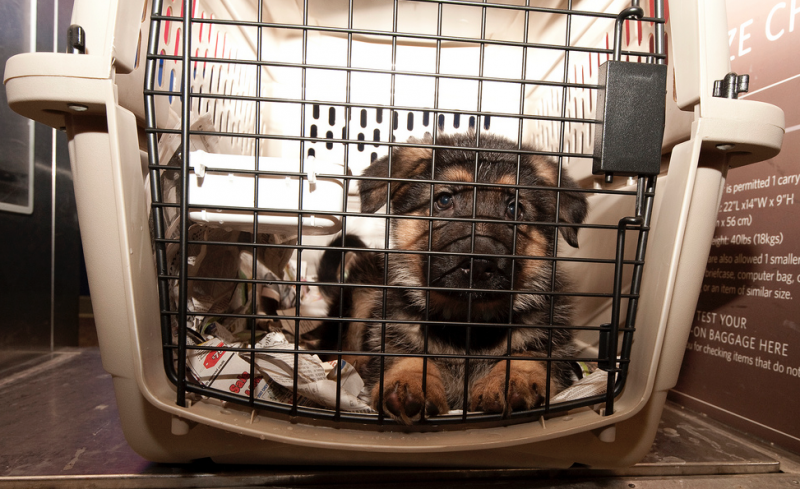
Where is `box`? The width and height of the screenshot is (800, 489). box is located at coordinates (106, 175).